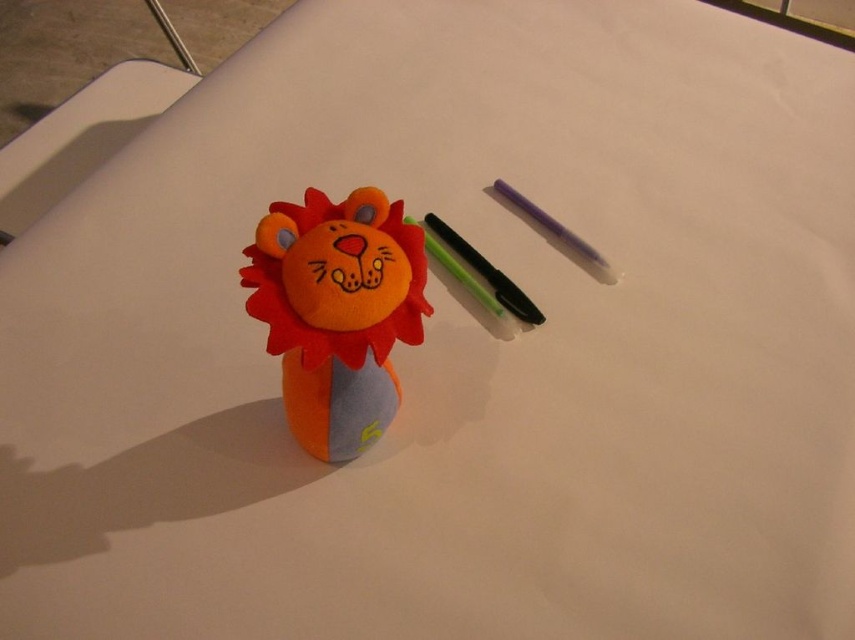
Which is more to the right, soft plush lion at center or black glossy pen at center?

From the viewer's perspective, black glossy pen at center appears more on the right side.

Who is more forward, (342, 314) or (506, 282)?

Positioned in front is point (342, 314).

The image size is (855, 640). Describe the element at coordinates (337, 312) in the screenshot. I see `soft plush lion at center` at that location.

The height and width of the screenshot is (640, 855). I want to click on soft plush lion at center, so click(337, 312).